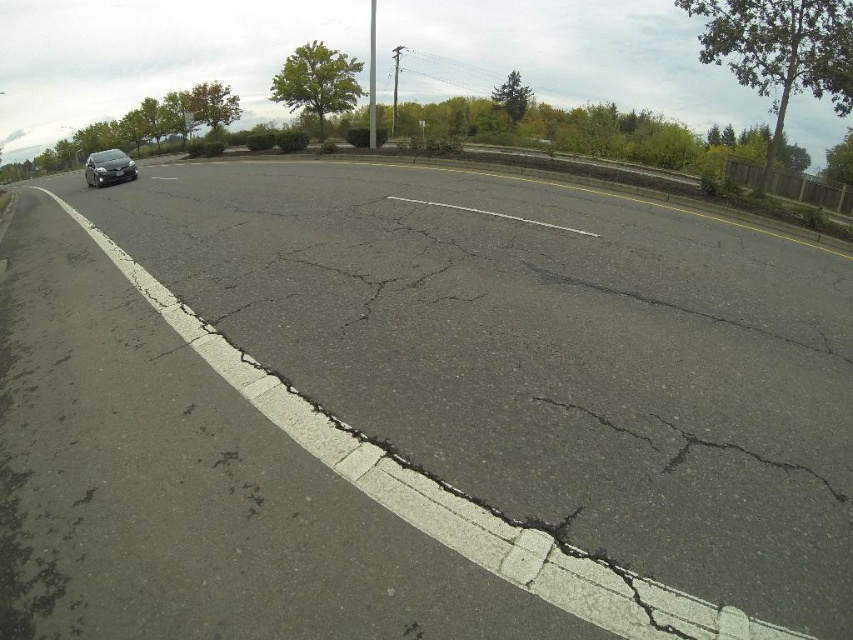
Looking at this image, you are a pedestrian standing on the sidewalk and see the black asphalt crack at center and the satin black car at left. Which object is closer to you?

The satin black car at left is closer to you because it is positioned over the black asphalt crack at center, indicating it is in front of it from your perspective.

You are standing at the edge of the road and want to determine the distance between two points marked on the road surface. The points are labeled as point (701, 310) and point (90, 157). Based on the scene, can you tell which point is closer to you?

Point (701, 310) is closer to the viewer than point (90, 157).